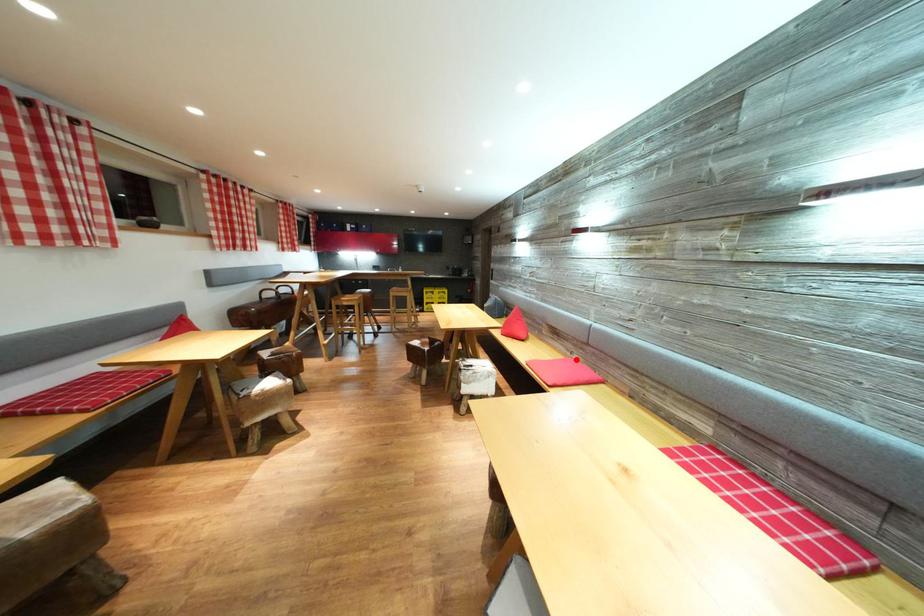
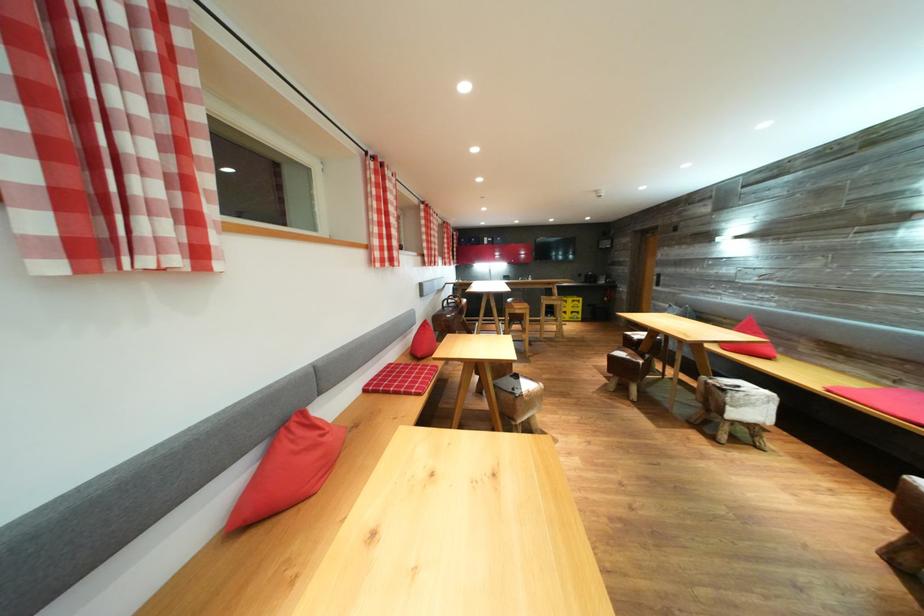
The point at the highlighted location is marked in the first image. Where is the corresponding point in the second image?

(895, 389)